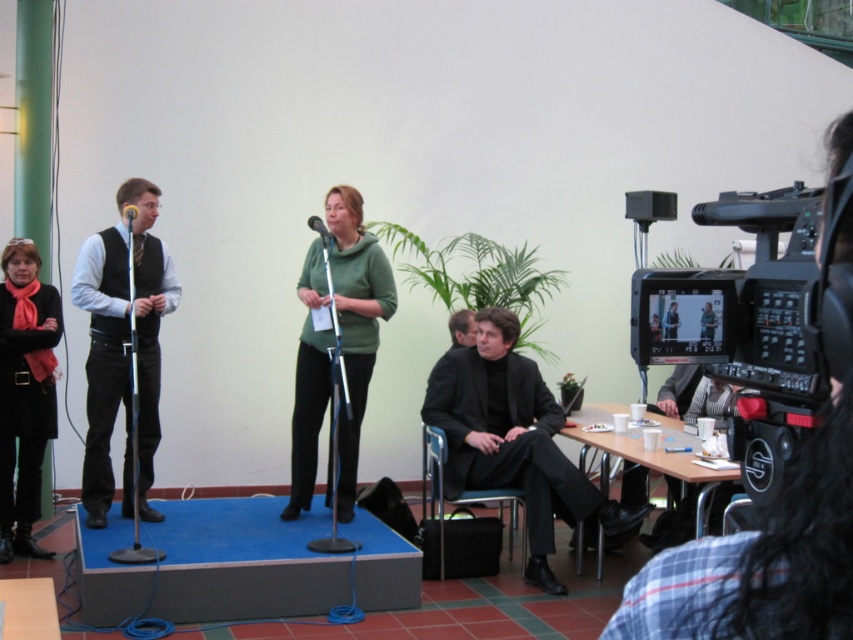
Based on the photo, is matte black vest at left above black wool coat at lower left?

Yes, matte black vest at left is above black wool coat at lower left.

Is point (109, 412) positioned in front of point (0, 506)?

Yes, point (109, 412) is in front of point (0, 506).

This screenshot has height=640, width=853. What are the coordinates of `matte black vest at left` in the screenshot? It's located at (103, 365).

Which of these two, black wool coat at lower left or metallic silver microphone at left, stands shorter?

With less height is metallic silver microphone at left.

Is black wool coat at lower left to the right of metallic silver microphone at left from the viewer's perspective?

No, black wool coat at lower left is not to the right of metallic silver microphone at left.

Is point (15, 284) less distant than point (134, 209)?

No, it is behind (134, 209).

Locate an element on the screen. The width and height of the screenshot is (853, 640). black wool coat at lower left is located at coordinates point(24,394).

Describe the element at coordinates (355, 320) in the screenshot. I see `green matte sweater at center` at that location.

Between point (346, 486) and point (134, 205), which one is positioned in front?

Point (134, 205)

Locate an element on the screen. The height and width of the screenshot is (640, 853). green matte sweater at center is located at coordinates (355, 320).